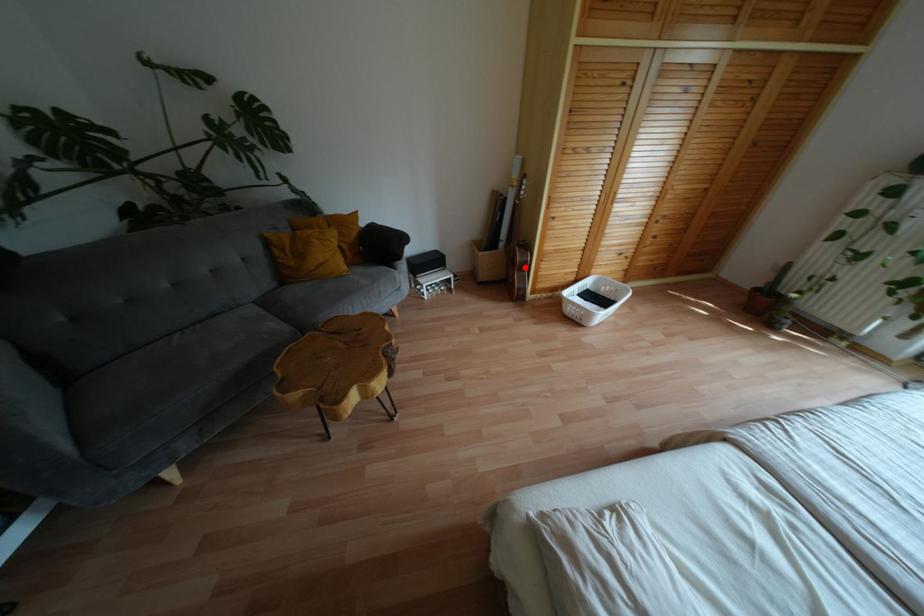
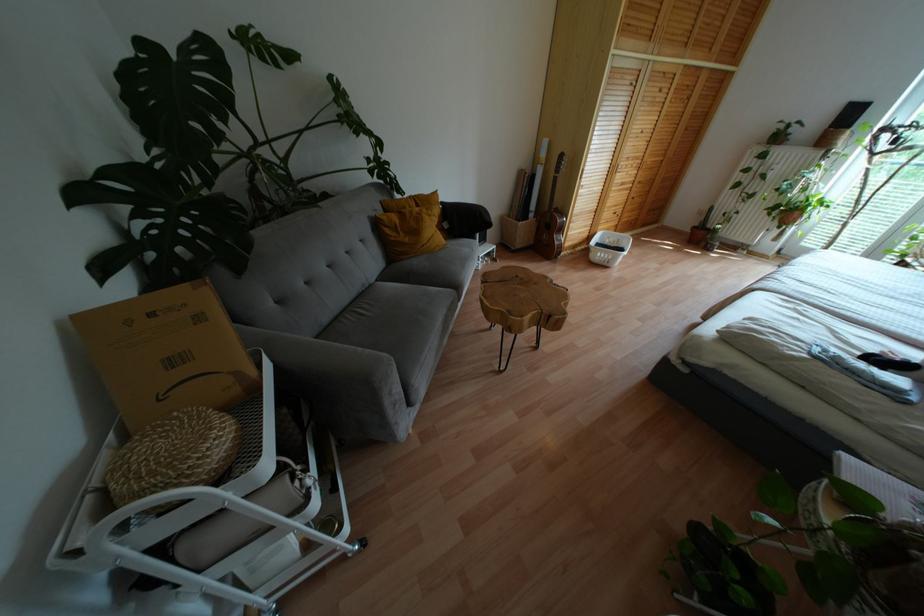
Where in the second image is the point corresponding to the highlighted location from the first image?

(560, 229)